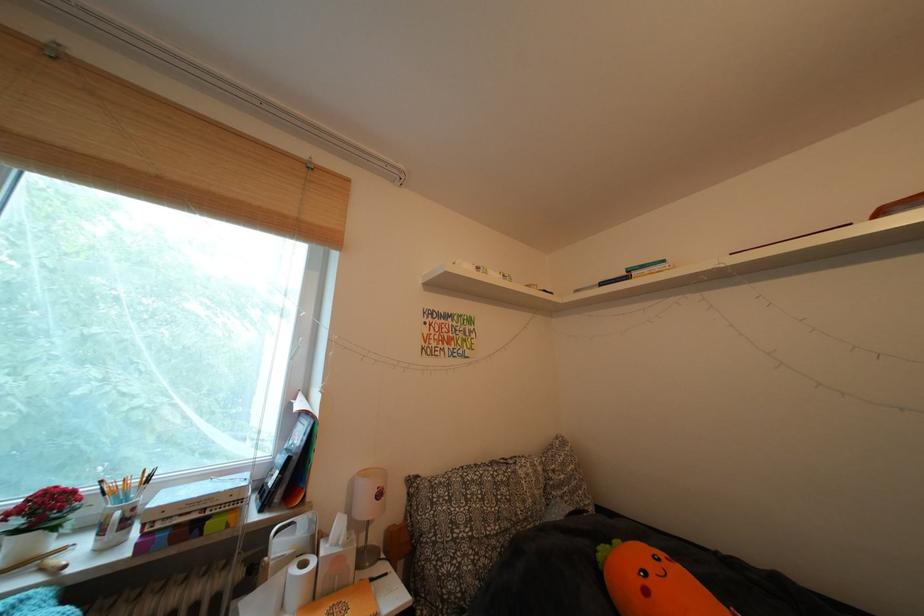
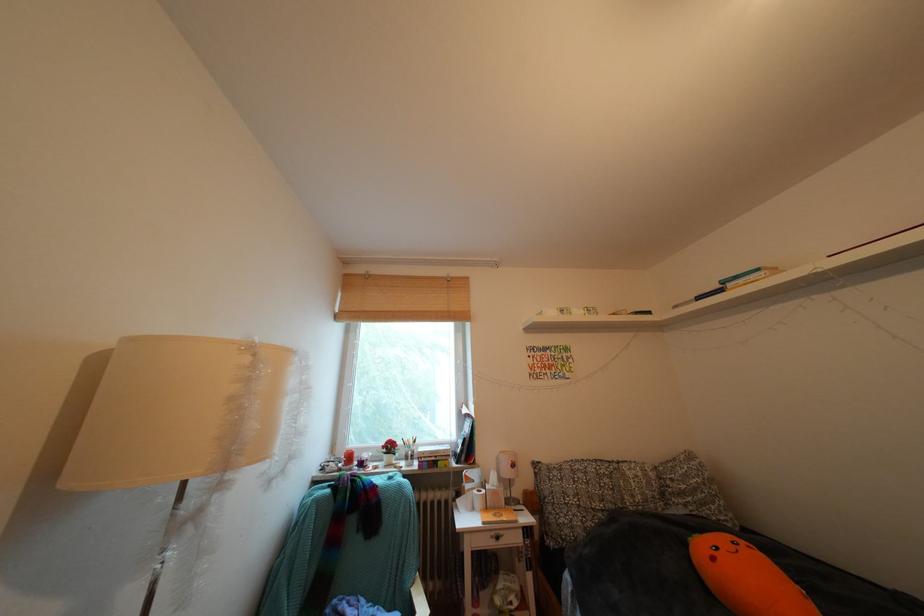
In the second image, find the point that corresponds to point (67, 61) in the first image.

(379, 282)